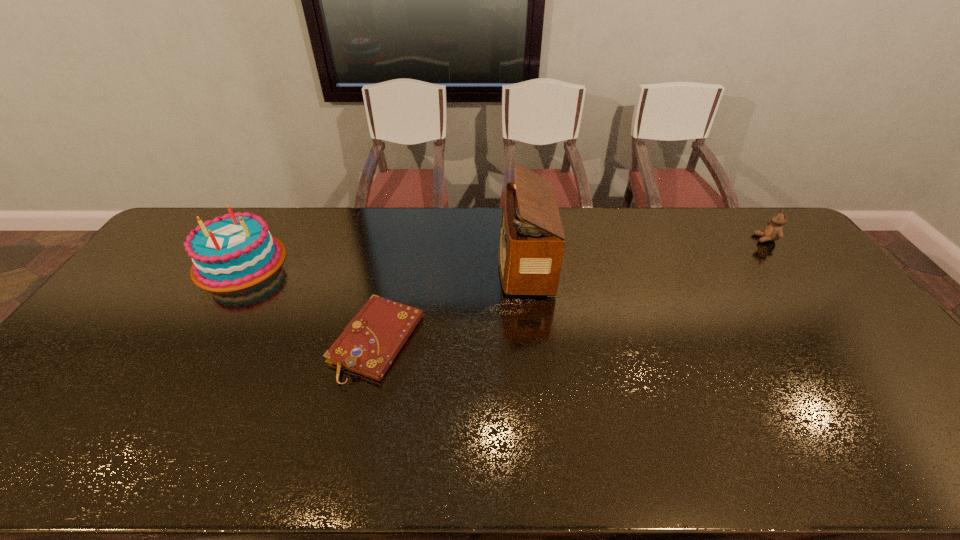
Where is `free space between the third object from left to right and the teddy bear`? free space between the third object from left to right and the teddy bear is located at coordinates (645, 251).

Identify the location of vacant space in between the shortest object and the third tallest object. (571, 290).

You are a GUI agent. You are given a task and a screenshot of the screen. Output one action in this format:
    pyautogui.click(x=<x>, y=<y>)
    Task: Click on the free area in between the tallest object and the teddy bear
    
    Given the screenshot: What is the action you would take?
    645,251

The height and width of the screenshot is (540, 960). I want to click on unoccupied area between the radio receiver and the notebook, so click(x=451, y=302).

Where is `free space between the second tallest object and the tallest object`? free space between the second tallest object and the tallest object is located at coordinates (382, 262).

In order to click on free spot between the radio receiver and the rightmost object in this screenshot , I will do `click(645, 251)`.

This screenshot has width=960, height=540. In order to click on vacant area that lies between the third tallest object and the radio receiver in this screenshot , I will do `click(645, 251)`.

Locate which object ranks second in proximity to the second tallest object. Please provide its 2D coordinates. Your answer should be formatted as a tuple, i.e. [(x, y)], where the tuple contains the x and y coordinates of a point satisfying the conditions above.

[(531, 246)]

This screenshot has height=540, width=960. I want to click on object that can be found as the third closest to the third object from left to right, so click(x=774, y=231).

Where is `blank space that satisfies the following two spatial constraints: 1. on the front-facing side of the rightmost object; 2. on the front side of the shortest object`? blank space that satisfies the following two spatial constraints: 1. on the front-facing side of the rightmost object; 2. on the front side of the shortest object is located at coordinates (843, 341).